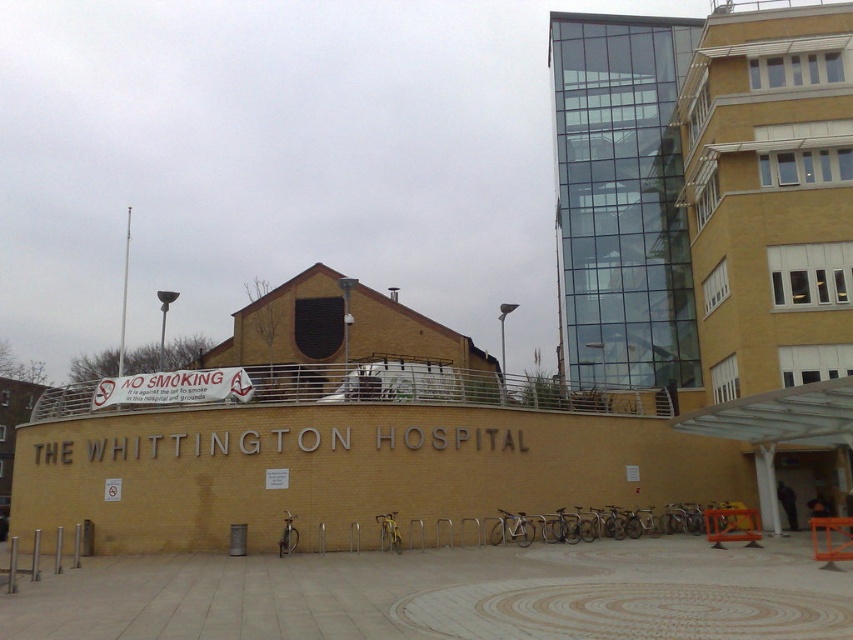
Question: Which of the following is the closest to the observer?

Choices:
 (A) (293, 531)
 (B) (589, 536)
 (C) (496, 540)

Answer: (A)

Question: Among these objects, which one is farthest from the camera?

Choices:
 (A) silver metallic bicycle at center
 (B) gold metallic bicycle at lower center

Answer: (A)

Question: Is silver metallic bicycle at center above gold metallic bicycle at lower center?

Choices:
 (A) no
 (B) yes

Answer: (A)

Question: Is gold metallic bicycle at lower center above yellow matte bicycle at center?

Choices:
 (A) no
 (B) yes

Answer: (A)

Question: Can you confirm if silver metallic bicycle at lower center is thinner than silver metallic bicycle at center?

Choices:
 (A) yes
 (B) no

Answer: (A)

Question: Among these points, which one is nearest to the camera?

Choices:
 (A) (390, 529)
 (B) (288, 515)
 (C) (561, 541)

Answer: (A)